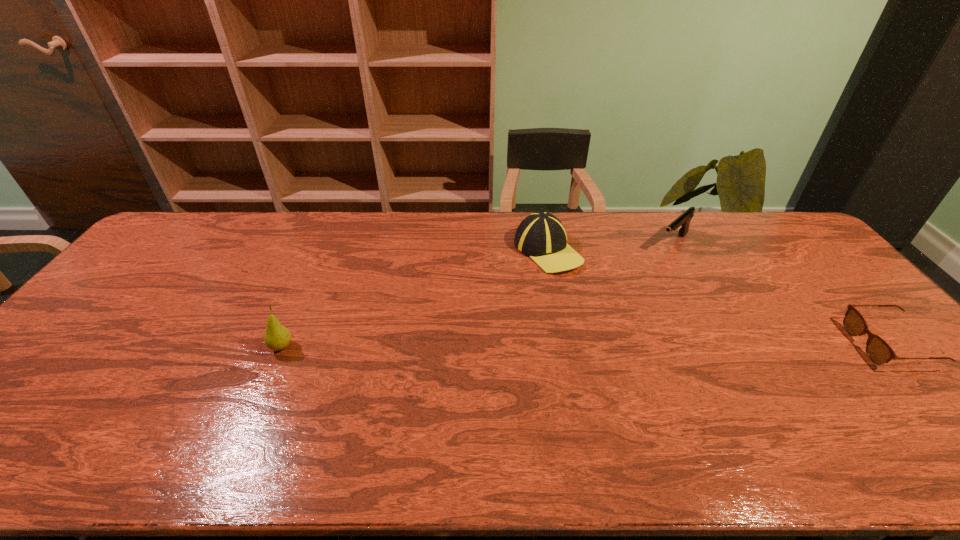
This screenshot has width=960, height=540. I want to click on vacant space located 0.070m with the brim of the baseball cap facing forward, so click(573, 289).

This screenshot has height=540, width=960. In order to click on free space located 0.090m with the brim of the baseball cap facing forward in this screenshot , I will do `click(576, 294)`.

Where is `free space located 0.310m with the brim of the baseball cap facing forward`? free space located 0.310m with the brim of the baseball cap facing forward is located at coordinates (613, 349).

Image resolution: width=960 pixels, height=540 pixels. Find the location of `free space located 0.310m at the muzzle of the pistol`. free space located 0.310m at the muzzle of the pistol is located at coordinates (612, 298).

Identify the location of free region located at the muzzle of the pistol. Image resolution: width=960 pixels, height=540 pixels. (608, 301).

Identify the location of free region located at the muzzle of the pistol. The height and width of the screenshot is (540, 960). (615, 294).

At what (x,y) coordinates should I click in order to perform the action: click on baseball cap located in the far edge section of the desktop. Please return your answer as a coordinate pair (x, y). Looking at the image, I should click on (541, 236).

Locate an element on the screen. The width and height of the screenshot is (960, 540). pistol that is at the far edge is located at coordinates (683, 221).

Where is `object that is at the right edge`? object that is at the right edge is located at coordinates (878, 351).

The height and width of the screenshot is (540, 960). What are the coordinates of `vacant space at the far edge of the desktop` in the screenshot? It's located at (261, 235).